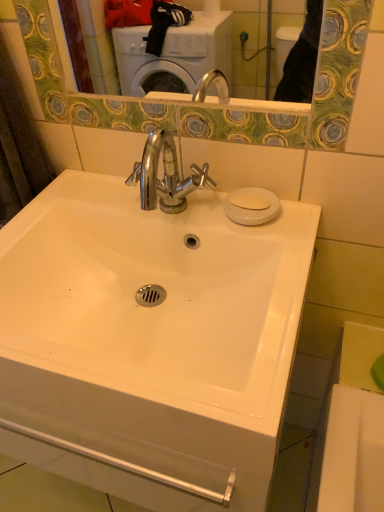
I want to click on blank space to the left of white matte soap at upper right, so (188, 204).